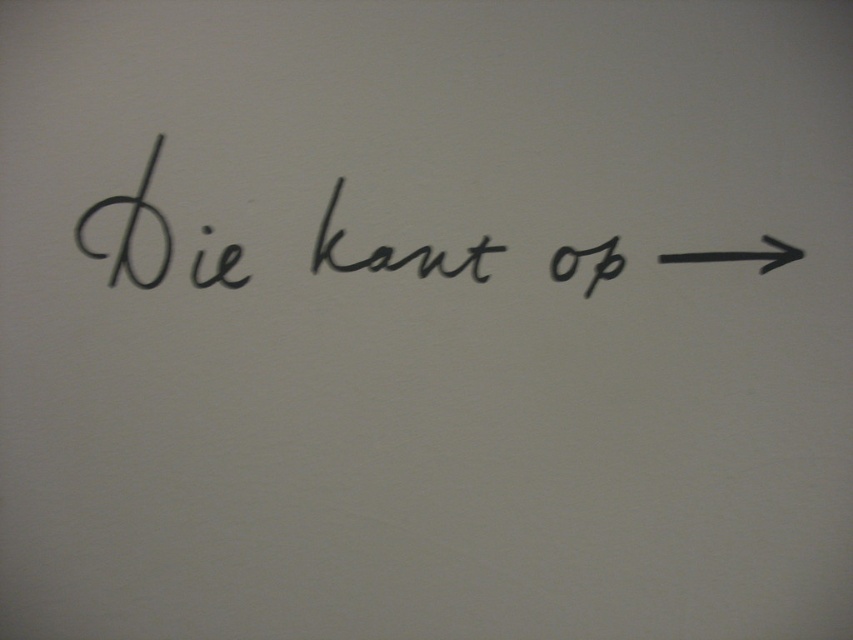
You are a delivery person who needs to follow the direction indicated by the black rubber arrow at right. However, you must ensure that the black handwritten text at center is visible from your current position. Is the text large enough to be easily readable from where you are standing?

The black handwritten text at center is larger than the black rubber arrow at right, so it should be easily readable from your current position as it is bigger in size.

You are in a museum and see the black handwritten text at center and the black rubber arrow at right. The text says, according to the scene description, it means

The black handwritten text at center says

You are navigating through a maze and see two points marked in the scene. Based on their positions, which point is closer to you, point (325, 227) or point (670, 262)?

Point (325, 227) is closer to the camera than point (670, 262), so the point closer to you is point (325, 227).